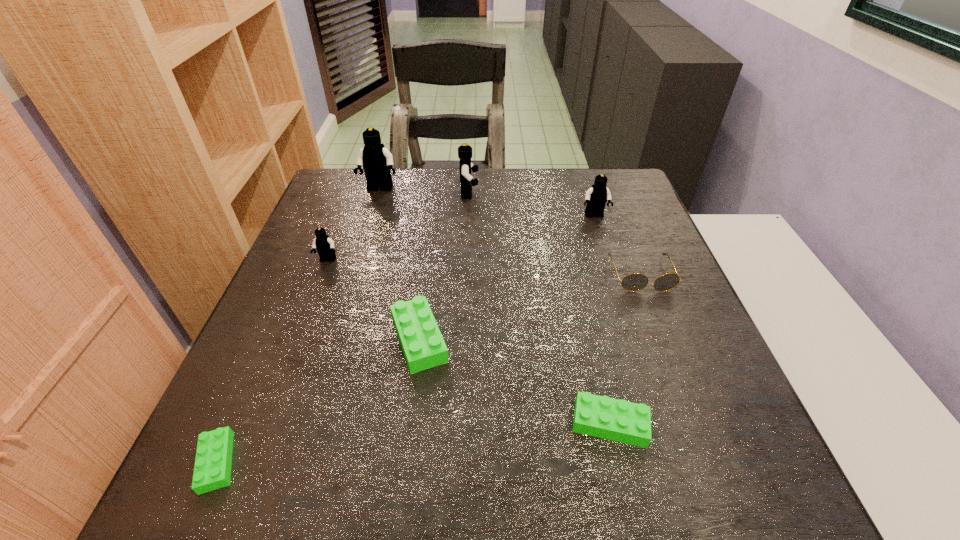
In the image, there is a desktop. Identify the location of vacant space at the near edge. The image size is (960, 540). (657, 501).

The height and width of the screenshot is (540, 960). Identify the location of free space at the left edge of the desktop. (346, 233).

In the image, there is a desktop. At what (x,y) coordinates should I click in order to perform the action: click on free space at the right edge. Please return your answer as a coordinate pair (x, y). The image size is (960, 540). Looking at the image, I should click on point(657,361).

You are a GUI agent. You are given a task and a screenshot of the screen. Output one action in this format:
    pyautogui.click(x=<x>, y=<y>)
    Task: Click on the vacant space at the far left corner of the desktop
    
    Given the screenshot: What is the action you would take?
    pyautogui.click(x=339, y=203)

Find the location of a particular element. Image resolution: width=960 pixels, height=540 pixels. vacant space at the near left corner is located at coordinates (246, 482).

Locate an element on the screen. free space at the far right corner of the desktop is located at coordinates click(612, 200).

Find the location of a particular element. free space between the second shortest Lego and the fifth shortest Lego is located at coordinates [602, 320].

Identify the location of vacant space that is in between the biggest green Lego and the smallest black Lego. (373, 300).

You are a GUI agent. You are given a task and a screenshot of the screen. Output one action in this format:
    pyautogui.click(x=<x>, y=<y>)
    Task: Click on the free space between the biggest black Lego and the sunglasses
    The image size is (960, 540).
    Given the screenshot: What is the action you would take?
    pyautogui.click(x=511, y=232)

Locate an element on the screen. empty space between the shortest Lego and the second green Lego from right to left is located at coordinates 318,401.